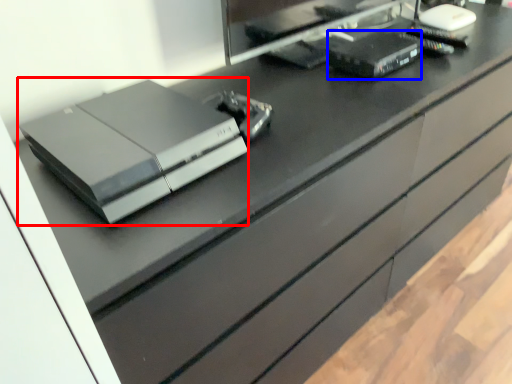
Question: Which of the following is the closest to the observer, printer (highlighted by a red box) or equipment (highlighted by a blue box)?

Choices:
 (A) printer
 (B) equipment

Answer: (A)